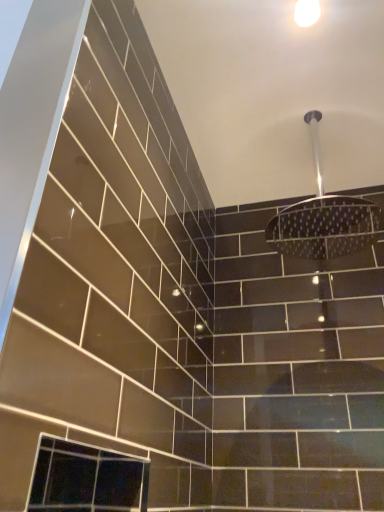
This screenshot has height=512, width=384. What do you see at coordinates (323, 218) in the screenshot?
I see `metallic silver showerhead at upper center` at bounding box center [323, 218].

You are a GUI agent. You are given a task and a screenshot of the screen. Output one action in this format:
    pyautogui.click(x=<x>, y=<y>)
    Task: Click on the metallic silver showerhead at upper center
    Image resolution: width=384 pixels, height=512 pixels.
    Given the screenshot: What is the action you would take?
    pyautogui.click(x=323, y=218)

Find the location of a particular element. The width and height of the screenshot is (384, 512). metallic silver showerhead at upper center is located at coordinates (323, 218).